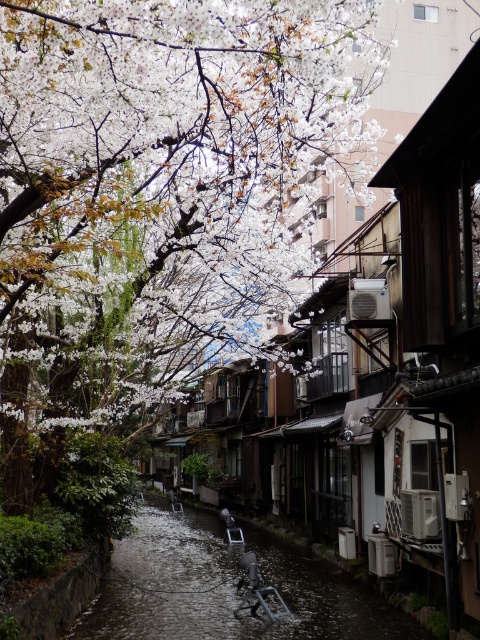
Question: Is white blossoms at upper center bigger than dark gray concrete river at center?

Choices:
 (A) no
 (B) yes

Answer: (B)

Question: Can you confirm if white blossoms at upper center is smaller than dark gray concrete river at center?

Choices:
 (A) no
 (B) yes

Answer: (A)

Question: Does white blossoms at upper center have a smaller size compared to dark gray concrete river at center?

Choices:
 (A) no
 (B) yes

Answer: (A)